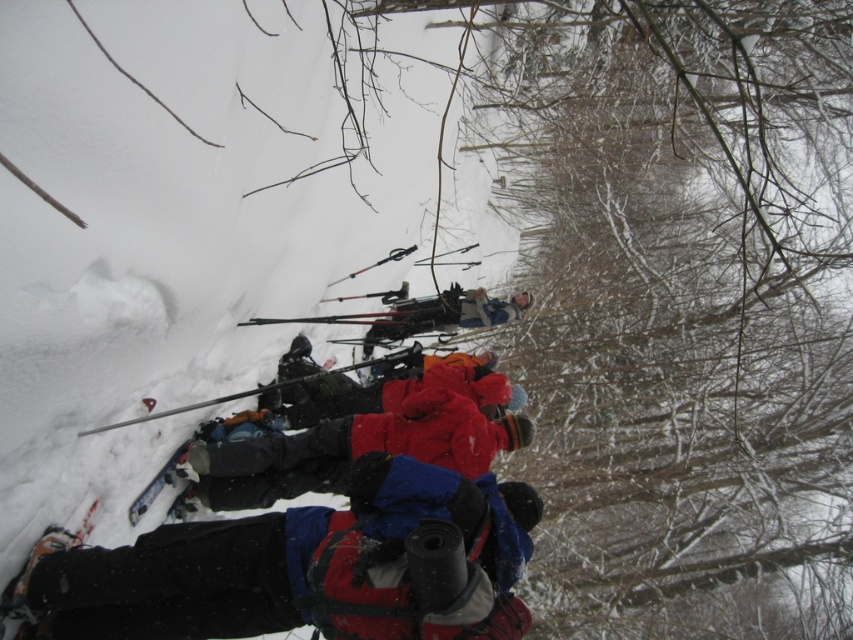
Question: Is red fleece jacket at center below matte black ski at lower left?

Choices:
 (A) yes
 (B) no

Answer: (B)

Question: Does red fuzzy jacket at center appear over matte black ski at lower left?

Choices:
 (A) yes
 (B) no

Answer: (A)

Question: Can you confirm if red fuzzy jacket at center is bigger than matte black ski at lower left?

Choices:
 (A) no
 (B) yes

Answer: (B)

Question: Among these objects, which one is nearest to the camera?

Choices:
 (A) red fabric jacket at center
 (B) red synthetic jacket at center

Answer: (B)

Question: Which point appears closest to the camera in this image?

Choices:
 (A) (393, 429)
 (B) (508, 625)
 (C) (378, 412)
 (D) (503, 301)

Answer: (B)

Question: Which object is closer to the camera taking this photo?

Choices:
 (A) red fuzzy jacket at center
 (B) matte black ski at lower left
 (C) red synthetic jacket at center
 (D) red fleece jacket at center

Answer: (C)